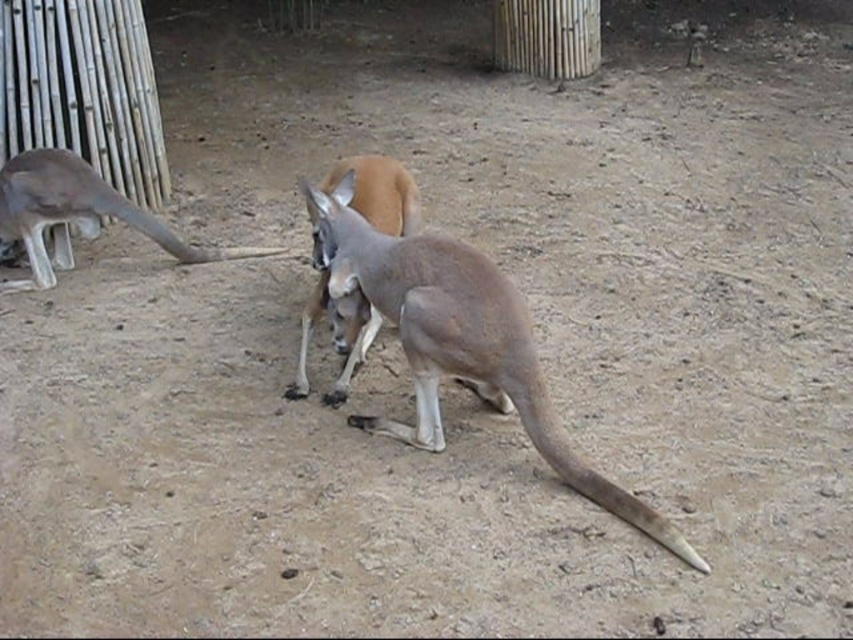
Looking at this image, can you confirm if gray fur kangaroo at center is positioned to the right of gray fur kangaroo at left?

Indeed, gray fur kangaroo at center is positioned on the right side of gray fur kangaroo at left.

Is point (480, 324) more distant than point (122, 195)?

No, (480, 324) is closer to viewer.

Where is `gray fur kangaroo at center`? The width and height of the screenshot is (853, 640). gray fur kangaroo at center is located at coordinates (462, 344).